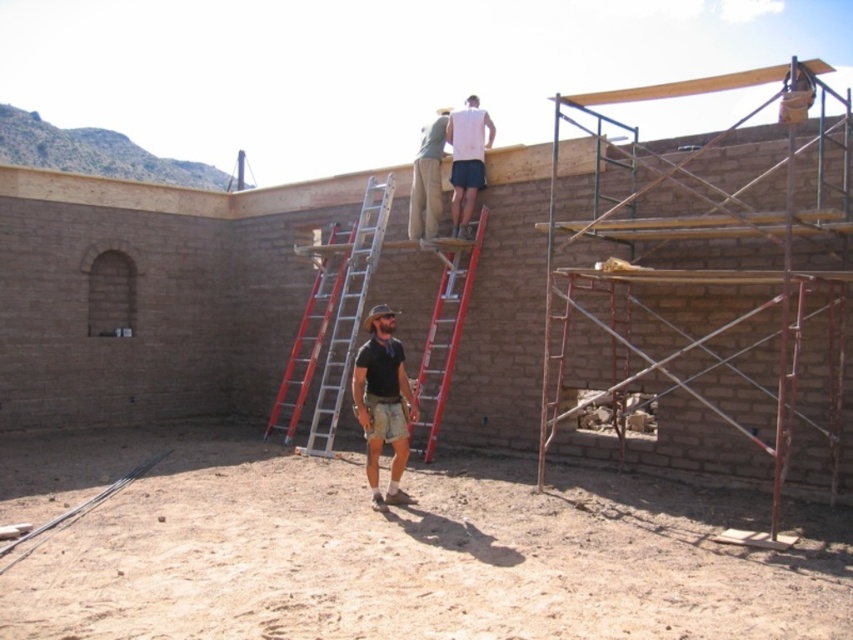
Question: Which object is the farthest from the silver/aluminum ladder at center?

Choices:
 (A) white matte shirt at upper center
 (B) khaki cotton pants at upper center
 (C) dark brown leather boots at center
 (D) red aluminum ladder at upper center

Answer: (C)

Question: Does silver/aluminum ladder at center appear on the right side of white matte shirt at upper center?

Choices:
 (A) no
 (B) yes

Answer: (A)

Question: Can you confirm if red aluminum ladder at upper center is positioned below white matte shirt at upper center?

Choices:
 (A) no
 (B) yes

Answer: (B)

Question: Which of the following is the closest to the observer?

Choices:
 (A) khaki cotton pants at upper center
 (B) dark brown leather boots at center
 (C) silver/aluminum ladder at center
 (D) red aluminum ladder at upper center

Answer: (B)

Question: Does silver/aluminum ladder at center appear on the right side of white matte shirt at upper center?

Choices:
 (A) no
 (B) yes

Answer: (A)

Question: Which object is closer to the camera taking this photo?

Choices:
 (A) white matte shirt at upper center
 (B) khaki cotton pants at upper center
 (C) dark brown leather boots at center

Answer: (C)